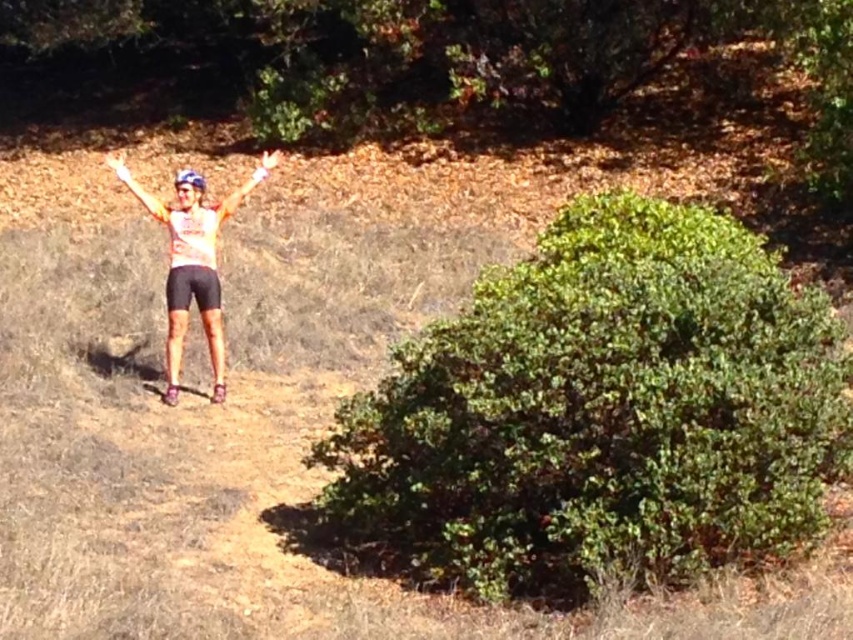
You are an athlete wearing an orange matte tank top at center and a matte orange glove at center. Which clothing item has a greater width?

The matte orange glove at center has a greater width than the orange matte tank top at center.

Based on the photo, you are a photographer trying to capture a clear shot of the orange matte tank top at center and the matte orange arm at center. Which object will appear closer to the camera in the photo?

The orange matte tank top at center will appear closer to the camera because it is in front of the matte orange arm at center.